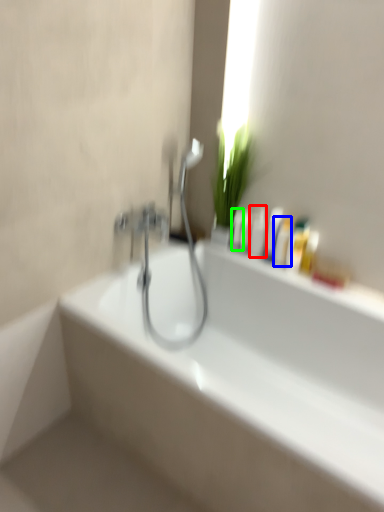
Question: Considering the real-world distances, which object is farthest from mouthwash (highlighted by a red box)? mouthwash (highlighted by a blue box) or mouthwash (highlighted by a green box)?

Choices:
 (A) mouthwash
 (B) mouthwash

Answer: (A)